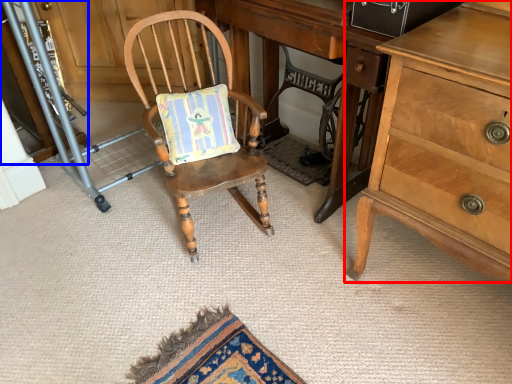
Question: Which of the following is the closest to the observer, chest of drawers (highlighted by a red box) or cabinetry (highlighted by a blue box)?

Choices:
 (A) chest of drawers
 (B) cabinetry

Answer: (A)